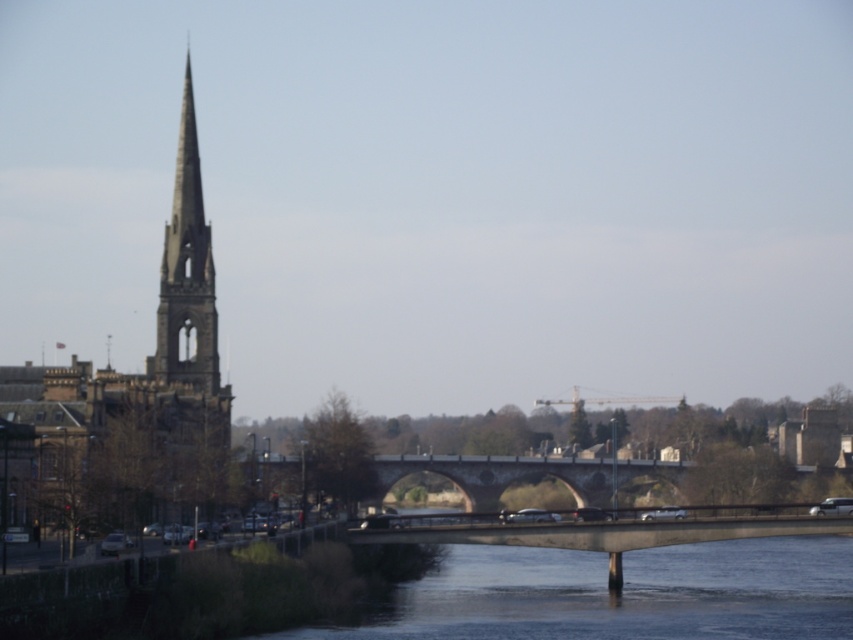
Question: Is dark gray concrete bridge at lower center smaller than stone bridge at center?

Choices:
 (A) no
 (B) yes

Answer: (A)

Question: Where is smooth stone spire at left located in relation to stone bridge at center in the image?

Choices:
 (A) above
 (B) below

Answer: (A)

Question: Which point is farther from the camera taking this photo?

Choices:
 (A) pos(563,465)
 (B) pos(456,576)
 (C) pos(181,220)

Answer: (C)

Question: Among these points, which one is farthest from the camera?

Choices:
 (A) (573, 586)
 (B) (200, 333)
 (C) (26, 417)

Answer: (B)

Question: Which of the following is the farthest from the observer?

Choices:
 (A) smooth stone spire at left
 (B) stone bridge at center
 (C) dark gray stone church steeple at left
 (D) dark gray concrete bridge at lower center

Answer: (A)

Question: Can you confirm if dark gray concrete bridge at lower center is positioned to the right of dark gray stone church steeple at left?

Choices:
 (A) no
 (B) yes

Answer: (B)